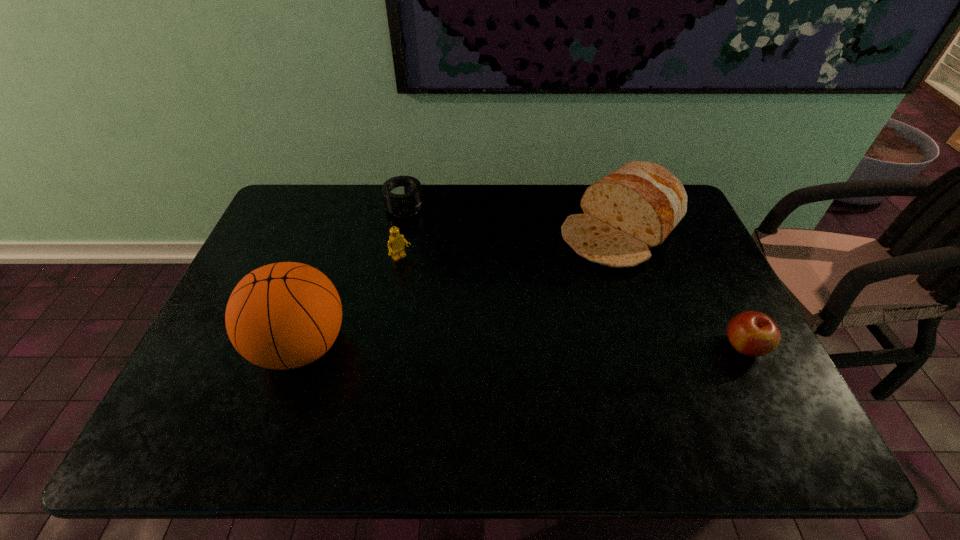
Locate an element on the screen. This screenshot has height=540, width=960. apple that is at the right edge is located at coordinates (752, 333).

The height and width of the screenshot is (540, 960). I want to click on bread that is positioned at the right edge, so click(634, 208).

This screenshot has width=960, height=540. Identify the location of object situated at the near left corner. (285, 315).

The height and width of the screenshot is (540, 960). What are the coordinates of `object at the far right corner` in the screenshot? It's located at (634, 208).

The width and height of the screenshot is (960, 540). Find the location of `vacant area at the far edge of the desktop`. vacant area at the far edge of the desktop is located at coordinates (434, 190).

This screenshot has height=540, width=960. In order to click on vacant space at the near edge of the desktop in this screenshot , I will do `click(257, 393)`.

You are a GUI agent. You are given a task and a screenshot of the screen. Output one action in this format:
    pyautogui.click(x=<x>, y=<y>)
    Task: Click on the vacant space at the right edge of the desktop
    The image size is (960, 540).
    Given the screenshot: What is the action you would take?
    pyautogui.click(x=763, y=371)

Locate an element on the screen. This screenshot has width=960, height=540. vacant space at the far left corner is located at coordinates (316, 195).

This screenshot has width=960, height=540. Find the location of `vacant space at the near right corner of the desktop`. vacant space at the near right corner of the desktop is located at coordinates (732, 388).

Where is `empty space between the Lego and the tallest object`? The image size is (960, 540). empty space between the Lego and the tallest object is located at coordinates (351, 302).